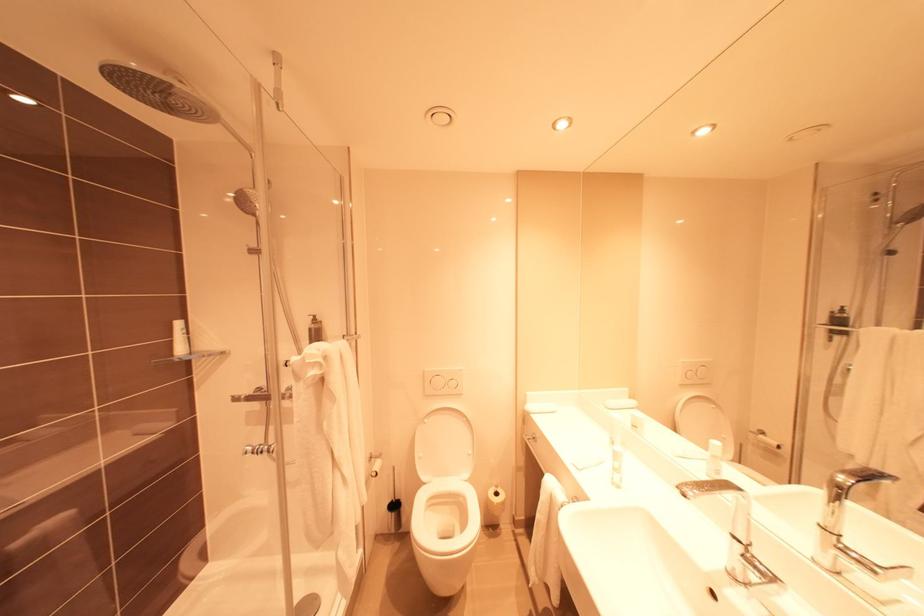
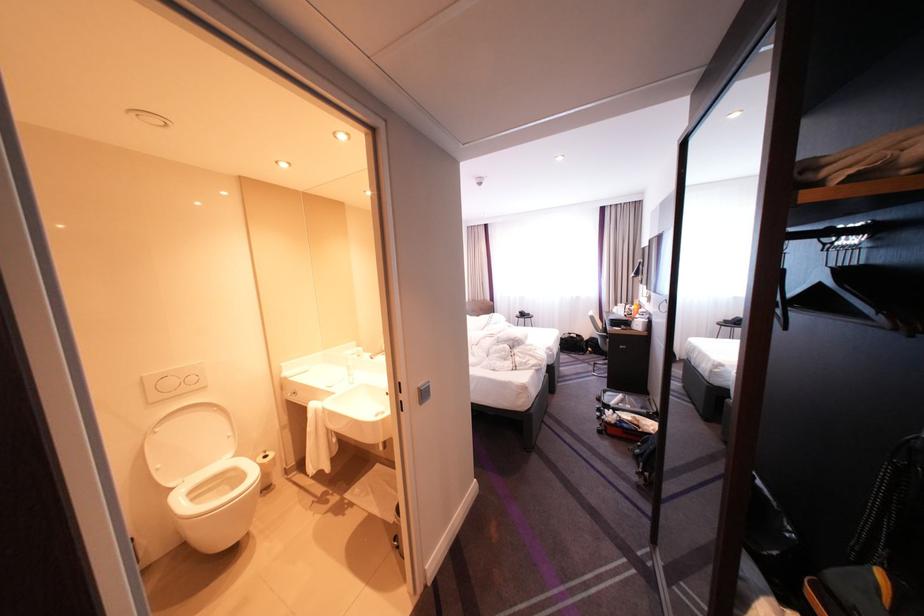
Locate, in the second image, the point that corresponds to point 690,492 in the first image.

(382, 359)